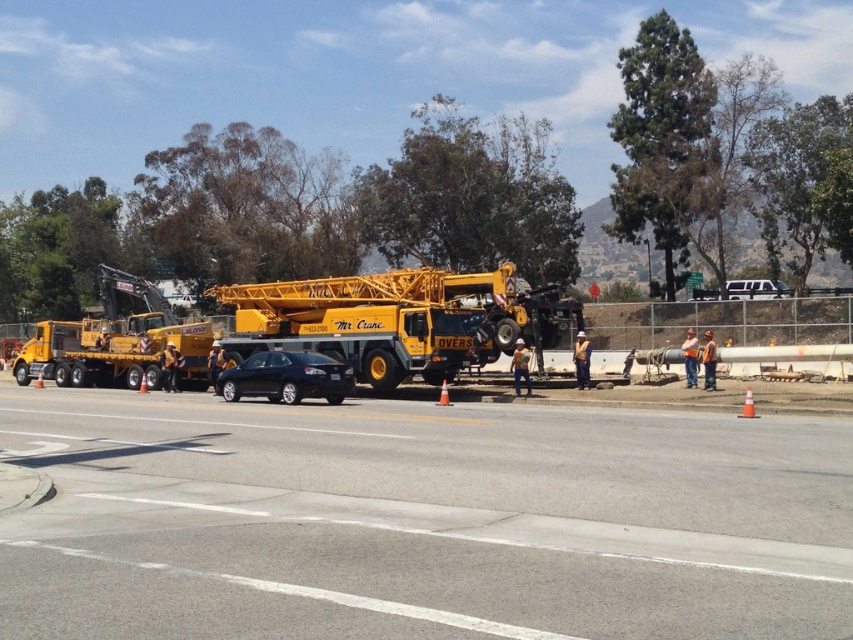
You are a delivery driver who needs to park your truck on the asphalt at center. The parking spot requires the truck to be positioned at point coordinates between 0.8 and 0.5 on both axes. Can you park your truck there?

The asphalt at center is located at point coordinates of (418, 520), which falls within the required range of 0.8 to 0.5 on both axes. Therefore, you can park your truck there.

What is located at the point with coordinates [418,520] in the image?

The point at coordinates [418,520] corresponds to asphalt at center.

You are a delivery driver who needs to park your truck at point (728,621). The crane is 6 meters long. Will the crane block your truck from entering the parking spot?

The distance between point (728,621) and the camera is 6.04 meters. Since the crane is only 6 meters long, there is enough space for the truck to enter the parking spot without obstruction.